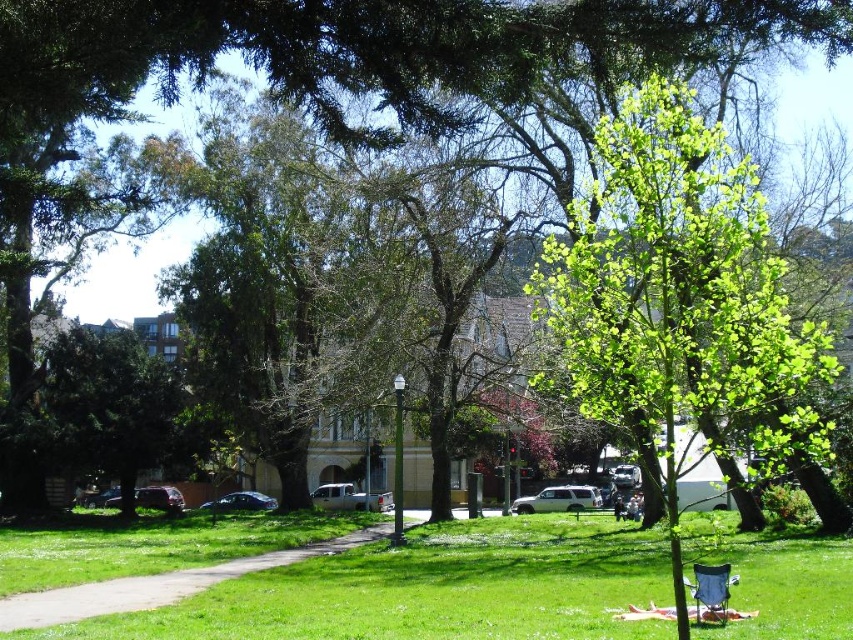
Looking at this image, who is positioned more to the right, green leafy tree at center or green grassy path at lower left?

Positioned to the right is green leafy tree at center.

Does green leafy tree at center appear under green grassy path at lower left?

Incorrect, green leafy tree at center is not positioned below green grassy path at lower left.

Find the location of a particular element. The width and height of the screenshot is (853, 640). green leafy tree at center is located at coordinates (680, 301).

Find the location of a particular element. Image resolution: width=853 pixels, height=640 pixels. green leafy tree at center is located at coordinates (680, 301).

Is point (366, 531) closer to viewer compared to point (711, 600)?

That is False.

Does green grassy path at lower left have a greater height compared to blue fabric chair at lower right?

Indeed, green grassy path at lower left has a greater height compared to blue fabric chair at lower right.

Where is `green grassy path at lower left`? green grassy path at lower left is located at coordinates (155, 586).

Is green leafy tree at center further to the viewer compared to blue fabric chair at lower right?

No, it is in front of blue fabric chair at lower right.

The width and height of the screenshot is (853, 640). What are the coordinates of `green leafy tree at center` in the screenshot? It's located at (680, 301).